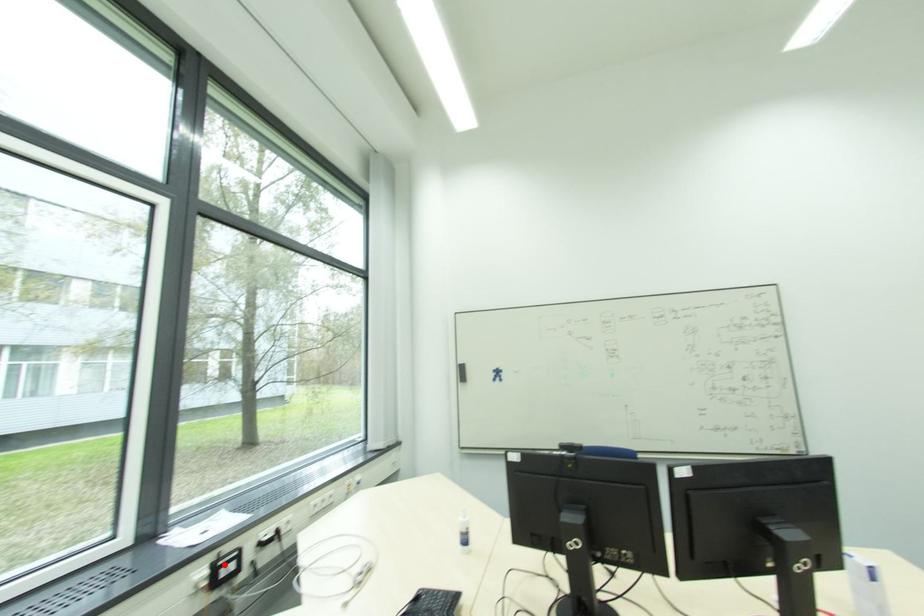
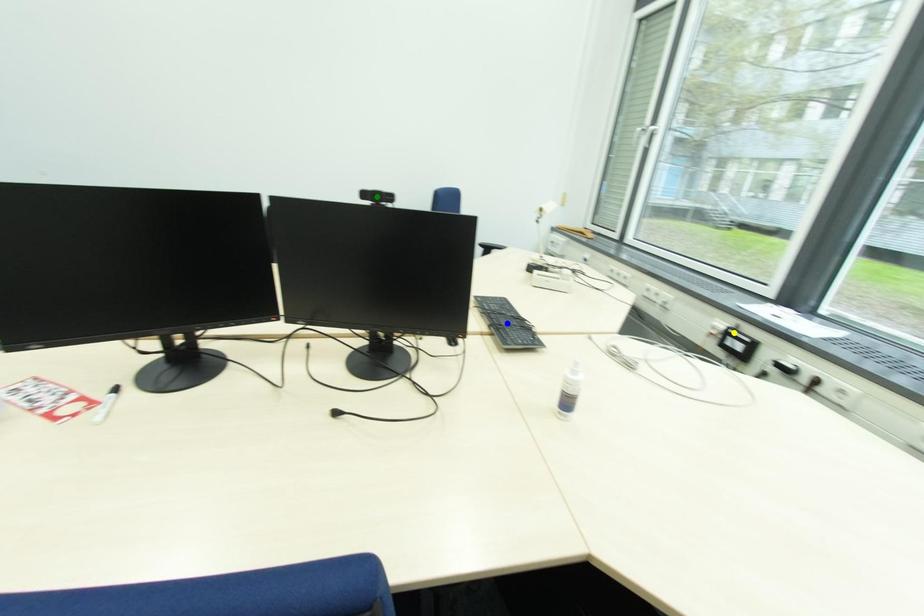
Question: I am providing you with two images of the same scene from different viewpoints. A red point is marked on the first image. You are given multiple points on the second image. In image 2, which mark is for the same physical point as the one in image 1?

Choices:
 (A) blue point
 (B) green point
 (C) yellow point

Answer: (C)